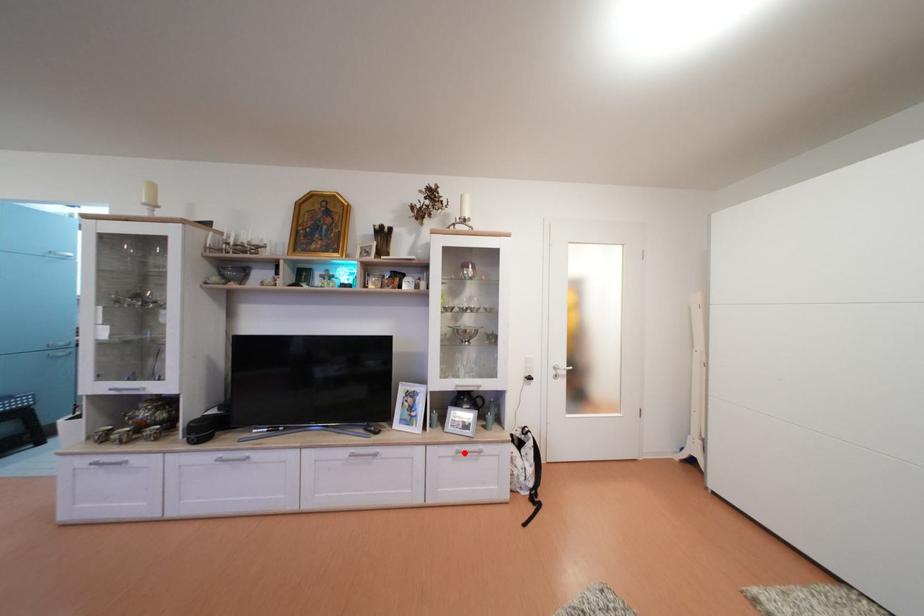
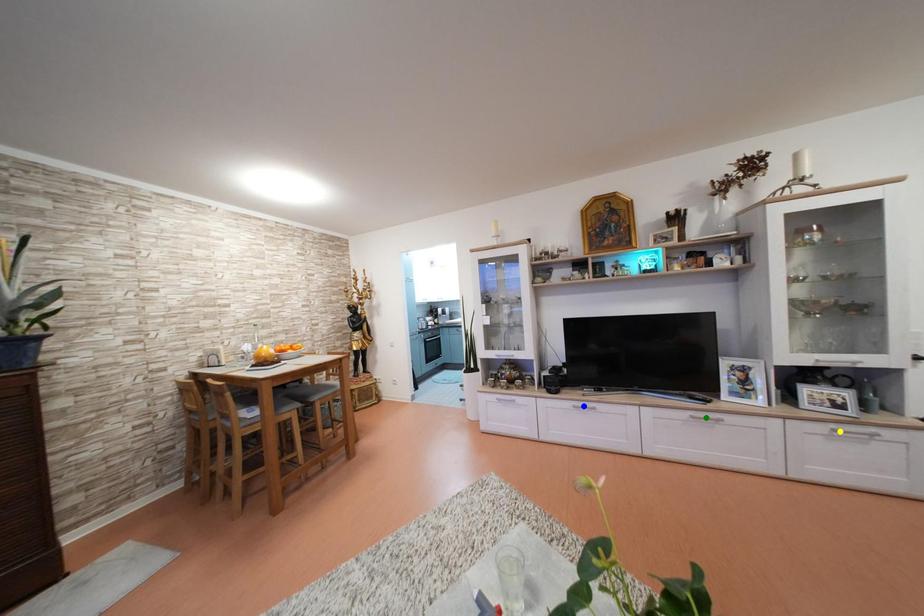
Question: I am providing you with two images of the same scene from different viewpoints. A red point is marked on the first image. You are given multiple points on the second image. Which mark in image 2 goes with the point in image 1?

Choices:
 (A) yellow point
 (B) green point
 (C) blue point

Answer: (A)